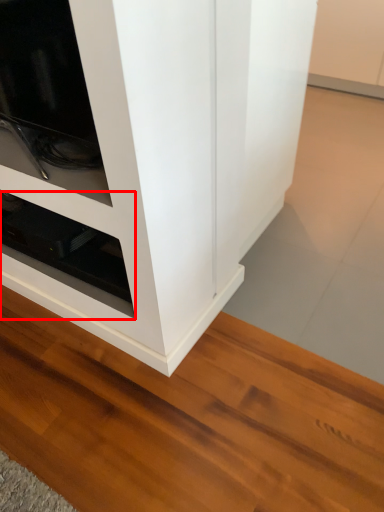
Question: Observing the image, what is the correct spatial positioning of shelf (annotated by the red box) in reference to cupboard?

Choices:
 (A) left
 (B) right

Answer: (A)